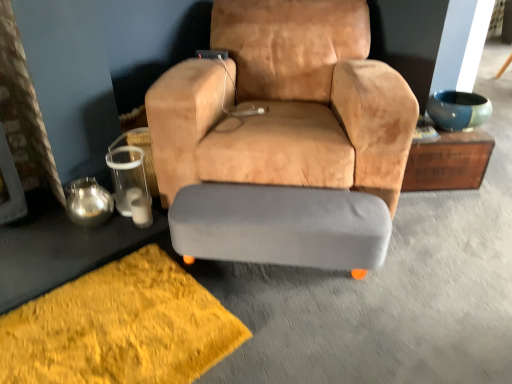
Question: Is metallic silver tray at lower left, the second table viewed from the right, surrounding gray fabric ottoman at center?

Choices:
 (A) no
 (B) yes

Answer: (A)

Question: From the image's perspective, is metallic silver tray at lower left, which is the second table from top to bottom, located above gray fabric ottoman at center?

Choices:
 (A) no
 (B) yes

Answer: (B)

Question: Is the depth of metallic silver tray at lower left, marked as the first table in a bottom-to-top arrangement, less than that of gray fabric ottoman at center?

Choices:
 (A) no
 (B) yes

Answer: (A)

Question: From a real-world perspective, is metallic silver tray at lower left, the second table viewed from the right, positioned under gray fabric ottoman at center based on gravity?

Choices:
 (A) no
 (B) yes

Answer: (B)

Question: Is metallic silver tray at lower left, the 1th table from the left, to the right of gray fabric ottoman at center from the viewer's perspective?

Choices:
 (A) no
 (B) yes

Answer: (A)

Question: Is metallic silver tray at lower left, the 1th table from the left, wider than gray fabric ottoman at center?

Choices:
 (A) no
 (B) yes

Answer: (B)

Question: Is shaggy yellow rug at lower left at the right side of metallic silver tray at lower left, marked as the first table in a bottom-to-top arrangement?

Choices:
 (A) no
 (B) yes

Answer: (B)

Question: Considering the relative positions of shaggy yellow rug at lower left and metallic silver tray at lower left, the 1th table from the left, in the image provided, is shaggy yellow rug at lower left behind metallic silver tray at lower left, the 1th table from the left,?

Choices:
 (A) no
 (B) yes

Answer: (A)

Question: Can you confirm if shaggy yellow rug at lower left is bigger than metallic silver tray at lower left, which is the second table from top to bottom?

Choices:
 (A) no
 (B) yes

Answer: (B)

Question: From a real-world perspective, is shaggy yellow rug at lower left under metallic silver tray at lower left, which is the second table from top to bottom?

Choices:
 (A) yes
 (B) no

Answer: (A)

Question: Could you tell me if shaggy yellow rug at lower left is turned towards metallic silver tray at lower left, marked as the first table in a bottom-to-top arrangement?

Choices:
 (A) no
 (B) yes

Answer: (A)

Question: Is shaggy yellow rug at lower left far away from metallic silver tray at lower left, which is the second table from top to bottom?

Choices:
 (A) yes
 (B) no

Answer: (B)

Question: Is gray fabric ottoman at center beside wooden chest at upper right, which is the second table in left-to-right order?

Choices:
 (A) yes
 (B) no

Answer: (B)